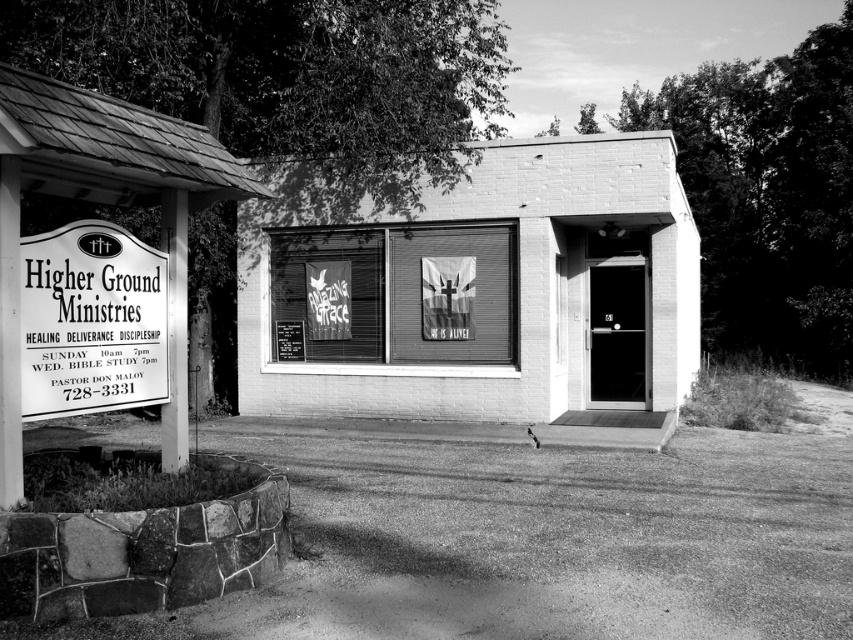
Can you confirm if white brick building at center is taller than metallic signboard at left?

Yes.

Locate an element on the screen. white brick building at center is located at coordinates (483, 294).